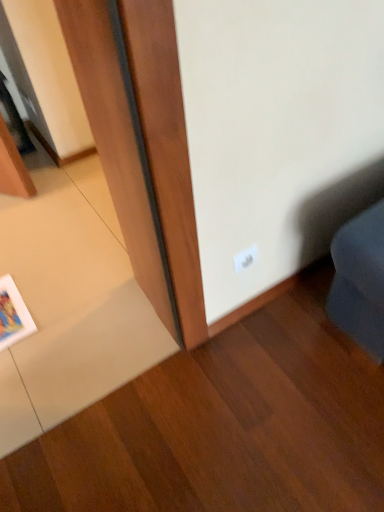
Question: Should I look upward or downward to see white plastic electric outlet at lower right?

Choices:
 (A) down
 (B) up

Answer: (A)